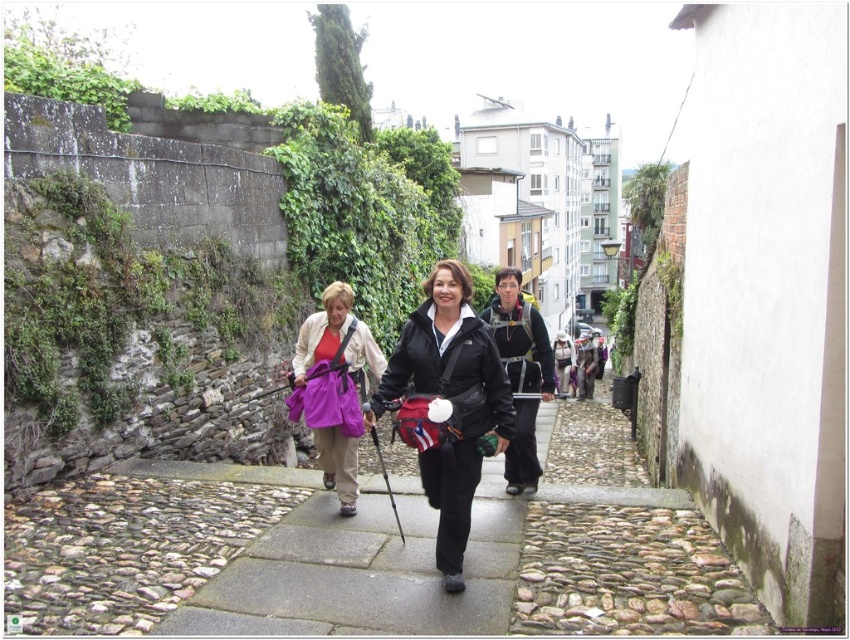
In the scene shown: You are a hiker trying to determine the order of the items in your view. Which item is positioned closer to you, the black matte jacket at center or the matte purple backpack at center?

The black matte jacket at center is closer to the viewer than the matte purple backpack at center.

You are a hiker looking at the scene described. There is a point marked at coordinates [450,403]. What object is located at this point?

The point at coordinates [450,403] indicates the black matte jacket at center.

Looking at this image, you are a photographer positioned at the start of the cobblestone path. You want to capture a photo of the black matte jacket at center and the matte purple backpack at center. Which object will appear wider in the photo?

The black matte jacket at center will appear wider in the photo because its width surpasses that of the matte purple backpack at center.